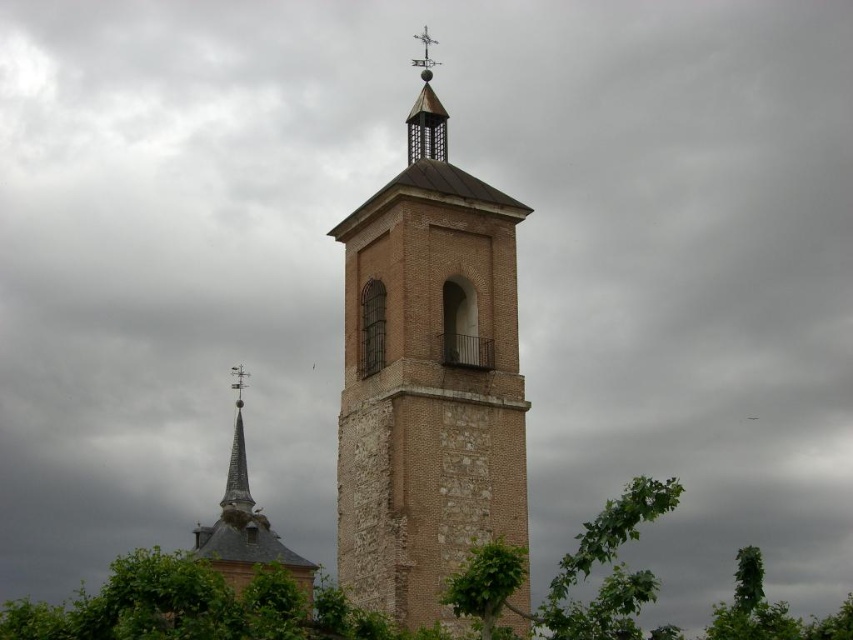
Question: Does smooth brick steeple at center appear on the left side of smooth gray spire at center?

Choices:
 (A) no
 (B) yes

Answer: (A)

Question: Where is brick tower at center located in relation to smooth brick steeple at center in the image?

Choices:
 (A) left
 (B) right

Answer: (B)

Question: In this image, where is brick tower at center located relative to smooth gray spire at center?

Choices:
 (A) above
 (B) below

Answer: (A)

Question: Which point is closer to the camera taking this photo?

Choices:
 (A) (244, 380)
 (B) (254, 548)

Answer: (B)

Question: Which of the following is the farthest from the observer?

Choices:
 (A) brick tower at center
 (B) smooth brick steeple at center

Answer: (B)

Question: Which object is closer to the camera taking this photo?

Choices:
 (A) smooth gray spire at center
 (B) smooth brick steeple at center
 (C) brick tower at center

Answer: (C)